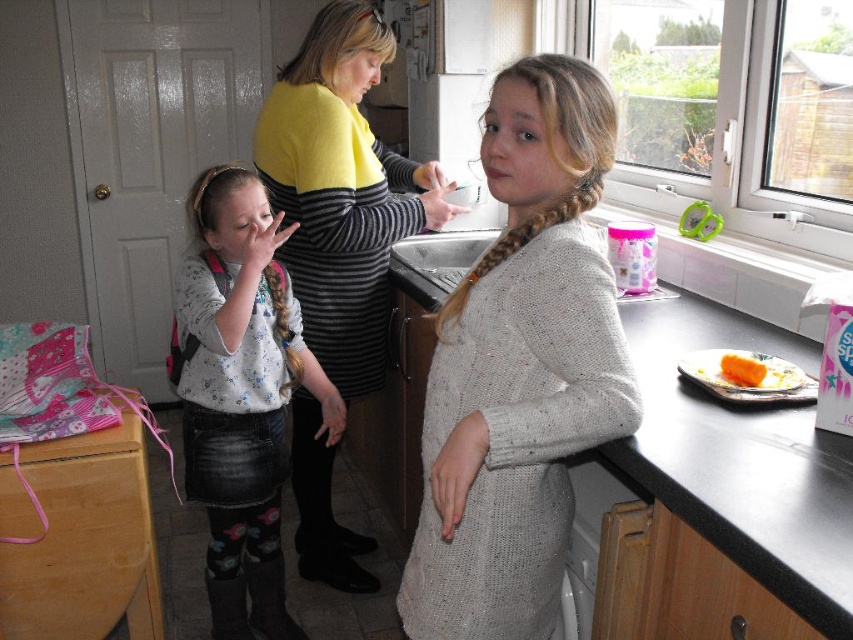
Question: Which object appears farthest from the camera in this image?

Choices:
 (A) orange matte carrot at right
 (B) knitted sweater at center
 (C) black laminate counter at center
 (D) yellow sweater at center

Answer: (D)

Question: Which point appears closest to the camera in this image?

Choices:
 (A) (763, 376)
 (B) (537, 566)
 (C) (344, 141)
 (D) (796, 481)

Answer: (D)

Question: Where is black laminate counter at center located in relation to orange matte carrot at right in the image?

Choices:
 (A) below
 (B) above

Answer: (B)

Question: Does knitted sweater at center appear over fluffy white sweater at center?

Choices:
 (A) yes
 (B) no

Answer: (A)

Question: Which object is positioned farthest from the fluffy white sweater at center?

Choices:
 (A) yellow sweater at center
 (B) black laminate counter at center
 (C) orange matte carrot at right

Answer: (C)

Question: Is black laminate counter at center positioned before fluffy white sweater at center?

Choices:
 (A) yes
 (B) no

Answer: (A)